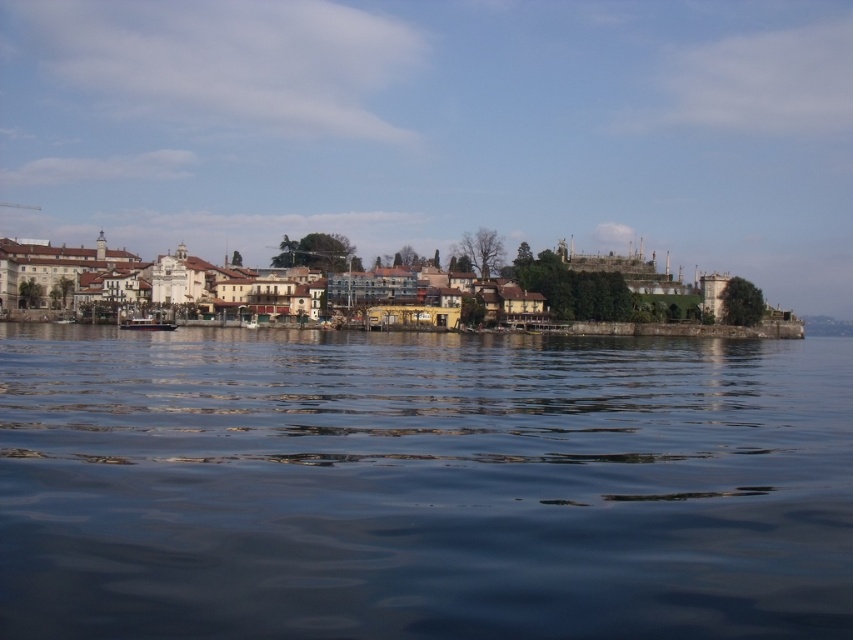
In the scene shown: Which of these two, dark blue water at center or multicolored wooden houses at center, stands taller?

multicolored wooden houses at center

Consider the image. Can you confirm if dark blue water at center is positioned to the left of multicolored wooden houses at center?

No, dark blue water at center is not to the left of multicolored wooden houses at center.

Is point (508, 580) positioned after point (427, 275)?

No, it is not.

Locate an element on the screen. dark blue water at center is located at coordinates (421, 484).

Is multicolored wooden houses at center to the right of metallic polished boat at center from the viewer's perspective?

Correct, you'll find multicolored wooden houses at center to the right of metallic polished boat at center.

Is multicolored wooden houses at center smaller than metallic polished boat at center?

Incorrect, multicolored wooden houses at center is not smaller in size than metallic polished boat at center.

Is point (537, 316) positioned before point (144, 321)?

No, it is behind (144, 321).

Image resolution: width=853 pixels, height=640 pixels. I want to click on multicolored wooden houses at center, so tap(697, 326).

Is dark blue water at center smaller than metallic polished boat at center?

No, dark blue water at center is not smaller than metallic polished boat at center.

Is point (505, 342) less distant than point (148, 321)?

That is True.

Locate an element on the screen. This screenshot has width=853, height=640. dark blue water at center is located at coordinates (421, 484).